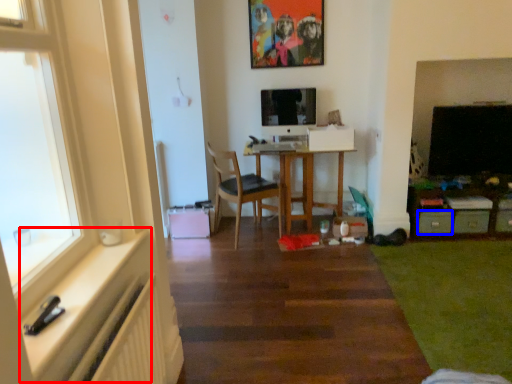
Question: Which object appears farthest to the camera in this image, window sill (highlighted by a red box) or drawer (highlighted by a blue box)?

Choices:
 (A) window sill
 (B) drawer

Answer: (B)